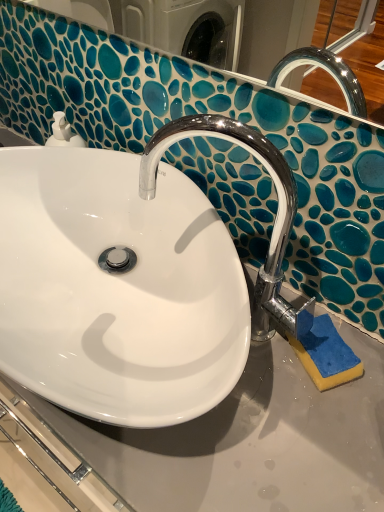
Question: Is the position of blue sponge at lower right more distant than that of white glossy sink at center?

Choices:
 (A) yes
 (B) no

Answer: (A)

Question: From the image's perspective, is blue sponge at lower right above white glossy sink at center?

Choices:
 (A) yes
 (B) no

Answer: (B)

Question: Considering the relative sizes of blue sponge at lower right and white glossy sink at center in the image provided, is blue sponge at lower right bigger than white glossy sink at center?

Choices:
 (A) yes
 (B) no

Answer: (B)

Question: From a real-world perspective, is blue sponge at lower right located higher than white glossy sink at center?

Choices:
 (A) yes
 (B) no

Answer: (B)

Question: Does blue sponge at lower right contain white glossy sink at center?

Choices:
 (A) no
 (B) yes

Answer: (A)

Question: Is blue sponge at lower right far from white glossy sink at center?

Choices:
 (A) no
 (B) yes

Answer: (A)

Question: Are white glossy sink at center and chrome/metallic faucet at center beside each other?

Choices:
 (A) no
 (B) yes

Answer: (A)

Question: Considering the relative sizes of white glossy sink at center and chrome/metallic faucet at center in the image provided, is white glossy sink at center thinner than chrome/metallic faucet at center?

Choices:
 (A) yes
 (B) no

Answer: (B)

Question: Is white glossy sink at center oriented away from chrome/metallic faucet at center?

Choices:
 (A) yes
 (B) no

Answer: (B)

Question: From the image's perspective, does white glossy sink at center appear lower than chrome/metallic faucet at center?

Choices:
 (A) yes
 (B) no

Answer: (A)

Question: Can you confirm if white glossy sink at center is positioned to the right of chrome/metallic faucet at center?

Choices:
 (A) no
 (B) yes

Answer: (A)

Question: Can you confirm if white glossy sink at center is wider than chrome/metallic faucet at center?

Choices:
 (A) no
 (B) yes

Answer: (B)

Question: Is blue sponge at lower right far from chrome/metallic faucet at center?

Choices:
 (A) no
 (B) yes

Answer: (A)